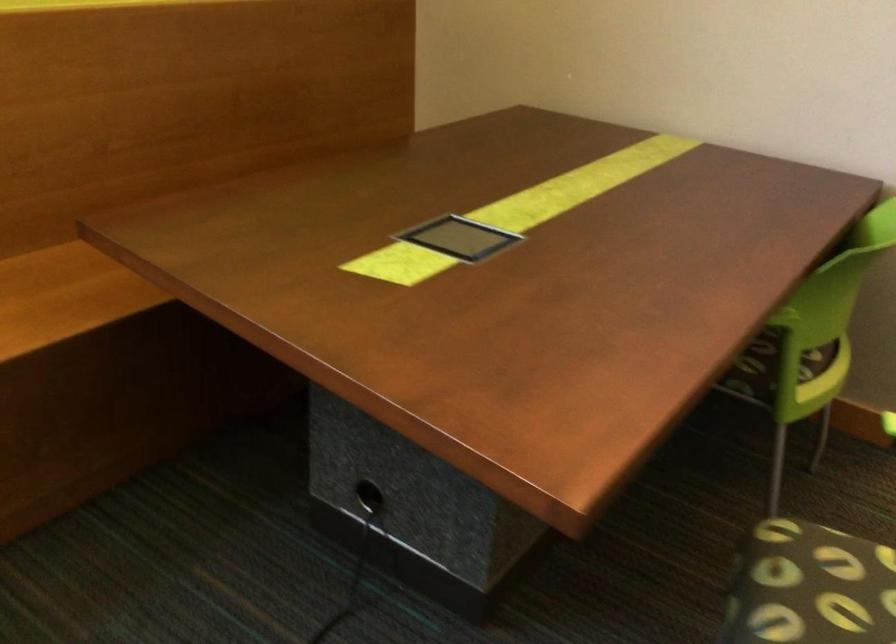
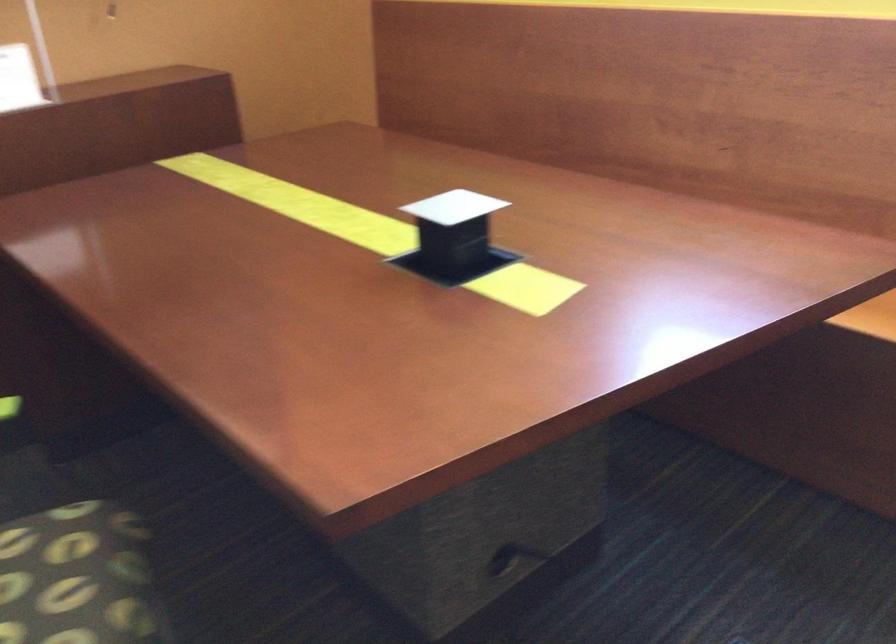
Based on the continuous images, in which direction is the camera rotating?

The rotation direction of the camera is left-down.